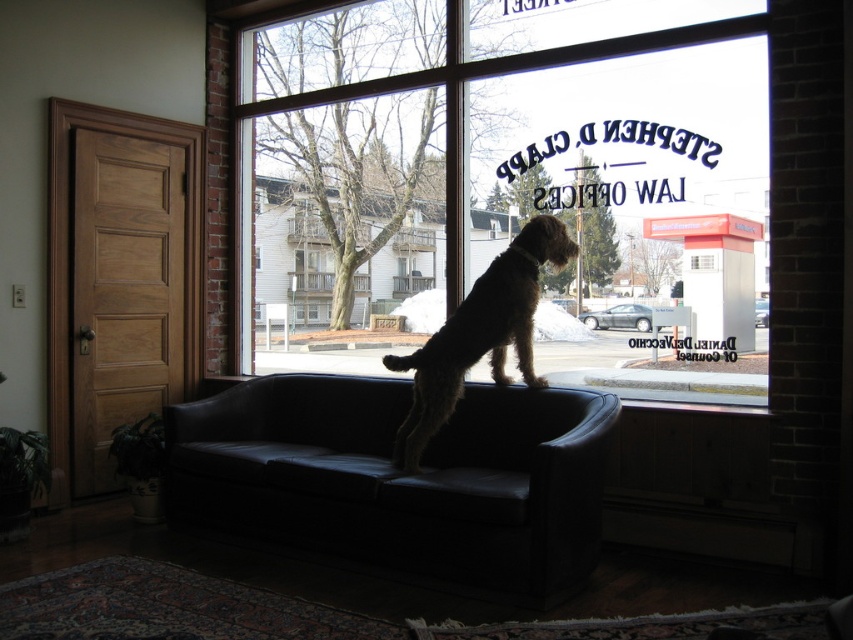
Who is lower down, black leather couch at center or brown textured fur dog at center?

black leather couch at center

Can you confirm if black leather couch at center is positioned above brown textured fur dog at center?

No.

Between point (271, 492) and point (531, 269), which one is positioned in front?

Point (271, 492)

What are the coordinates of `black leather couch at center` in the screenshot? It's located at (399, 477).

Does transparent glass window at center have a larger size compared to black leather couch at center?

Yes.

Which is above, transparent glass window at center or black leather couch at center?

transparent glass window at center

Who is more forward, (688, 296) or (361, 563)?

Positioned in front is point (361, 563).

Locate an element on the screen. Image resolution: width=853 pixels, height=640 pixels. transparent glass window at center is located at coordinates (509, 176).

Is point (276, 74) closer to viewer compared to point (517, 294)?

No, (276, 74) is further to viewer.

From the picture: Is transparent glass window at center further to the viewer compared to brown textured fur dog at center?

Yes.

Which is in front, point (515, 196) or point (527, 288)?

Point (527, 288) is in front.

Locate an element on the screen. The height and width of the screenshot is (640, 853). transparent glass window at center is located at coordinates (509, 176).